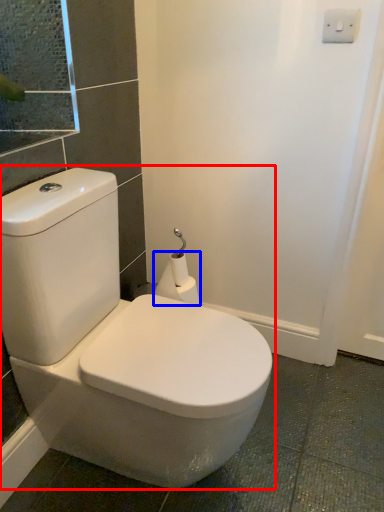
Question: Which object appears closest to the camera in this image, toilet (highlighted by a red box) or toilet paper (highlighted by a blue box)?

Choices:
 (A) toilet
 (B) toilet paper

Answer: (A)